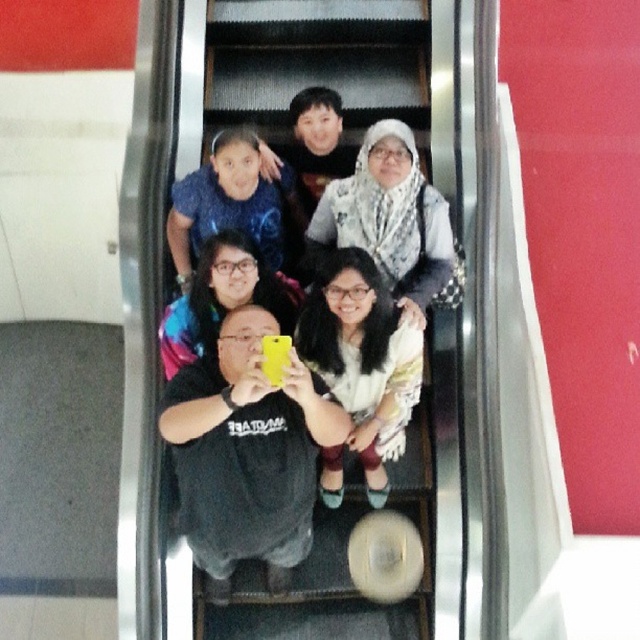
Question: Does white lace dress at center lie behind blue fabric at upper center?

Choices:
 (A) no
 (B) yes

Answer: (A)

Question: Which is farther from the black matte shirt at center?

Choices:
 (A) white lace dress at center
 (B) blue fabric at upper center

Answer: (B)

Question: Estimate the real-world distances between objects in this image. Which object is closer to the black matte shirt at center?

Choices:
 (A) white lace dress at center
 (B) blue fabric at upper center

Answer: (A)

Question: Can you confirm if white lace dress at center is bigger than blue fabric at upper center?

Choices:
 (A) no
 (B) yes

Answer: (B)

Question: Is white lace dress at center to the right of blue fabric at upper center from the viewer's perspective?

Choices:
 (A) yes
 (B) no

Answer: (A)

Question: Which object is farther from the camera taking this photo?

Choices:
 (A) white lace dress at center
 (B) black matte shirt at center
 (C) blue fabric at upper center

Answer: (C)